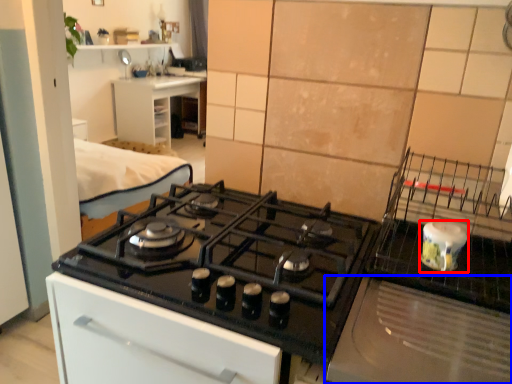
Question: Which of the following is the farthest to the observer, kitchen appliance (highlighted by a red box) or home appliance (highlighted by a blue box)?

Choices:
 (A) kitchen appliance
 (B) home appliance

Answer: (A)